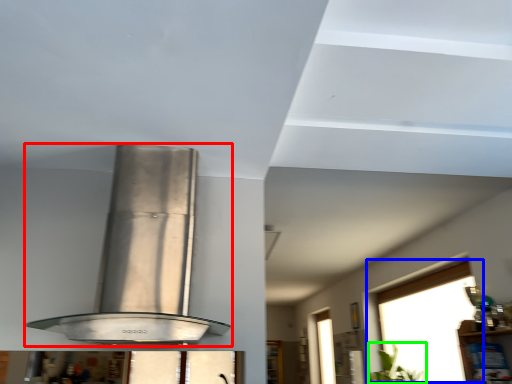
Question: Estimate the real-world distances between objects in this image. Which object is closer to kitchen appliance (highlighted by a red box), window (highlighted by a blue box) or plant (highlighted by a green box)?

Choices:
 (A) window
 (B) plant

Answer: (A)